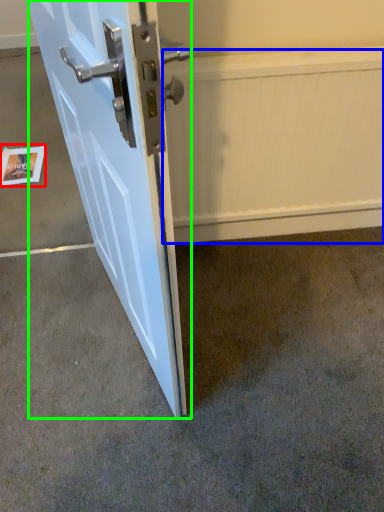
Question: Which object is positioned closest to postcard (highlighted by a red box)? Select from radiator (highlighted by a blue box) and door (highlighted by a green box).

Choices:
 (A) radiator
 (B) door

Answer: (B)